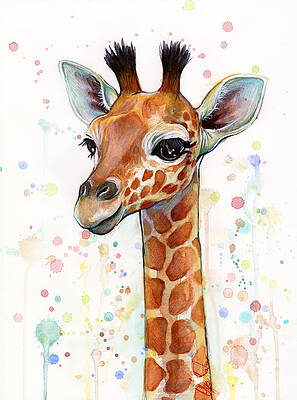
Where is `child room`? The width and height of the screenshot is (297, 400). child room is located at coordinates (253, 344).